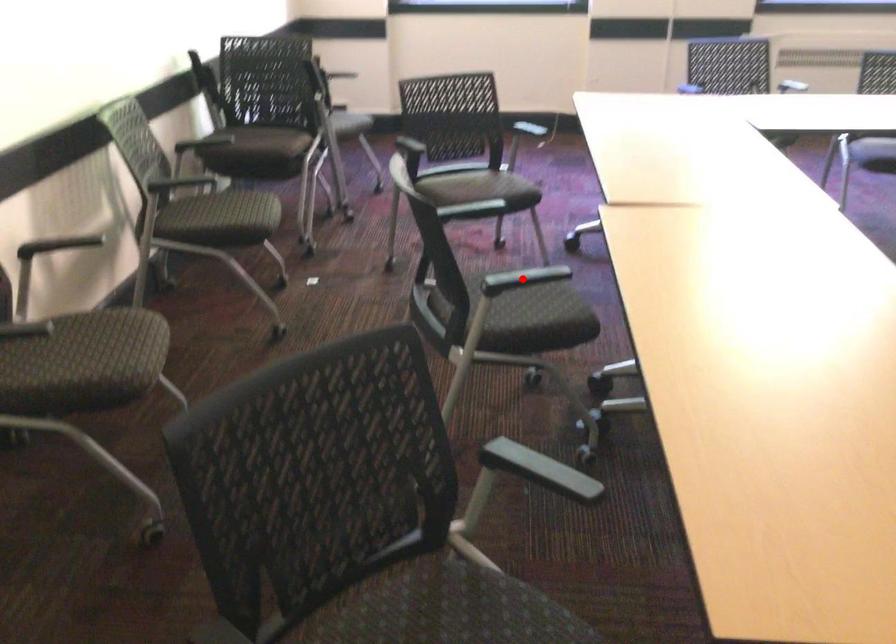
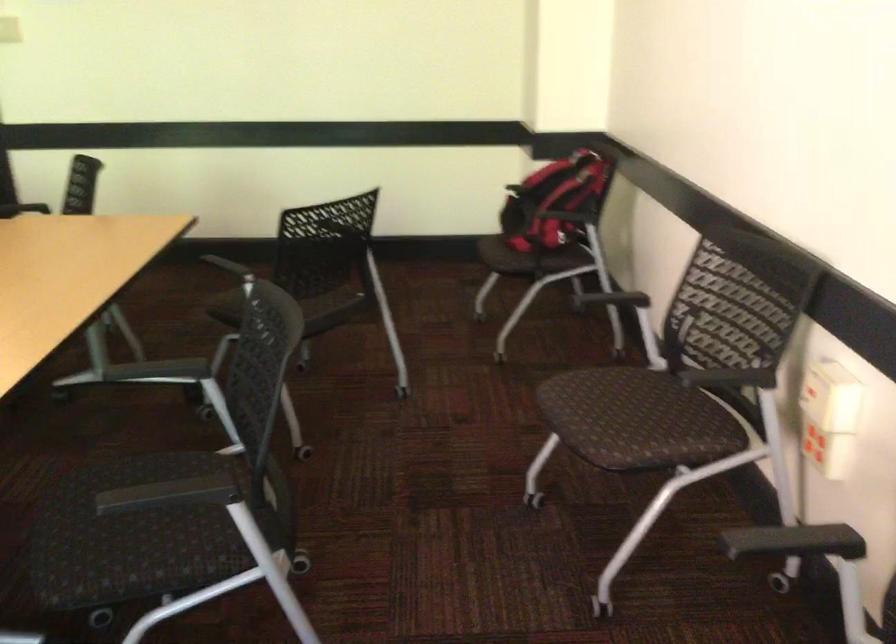
Question: I am providing you with two images of the same scene from different viewpoints. A red point is marked on the first image. At the location where the point appears in image 1, is it still visible in image 2?

Choices:
 (A) Yes
 (B) No

Answer: (B)